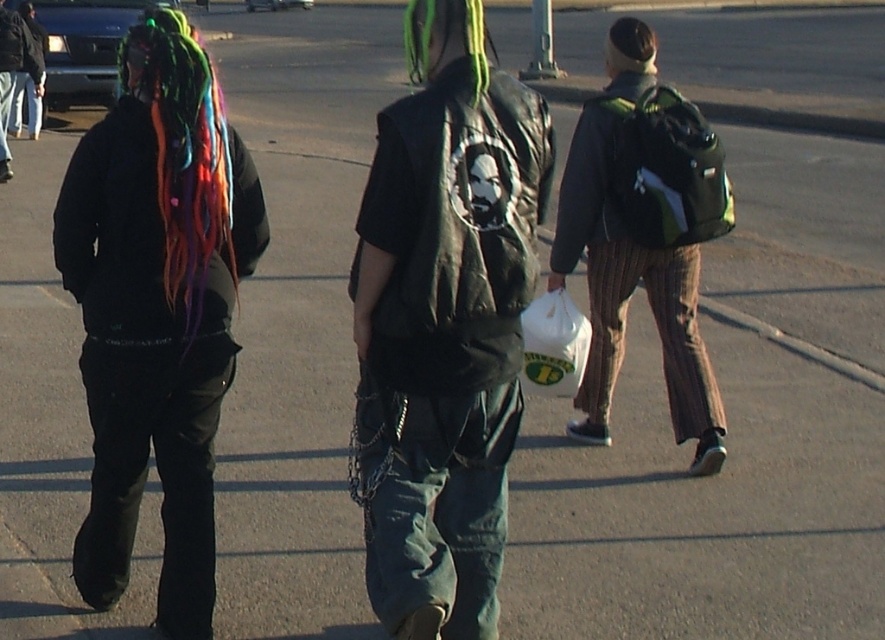
Who is positioned more to the left, black matte jacket at left or green matte hair at upper center?

Positioned to the left is black matte jacket at left.

Is black matte jacket at left above green matte hair at upper center?

No.

Where is `black matte jacket at left`? This screenshot has width=885, height=640. black matte jacket at left is located at coordinates (158, 308).

Where is `black matte jacket at left`? Image resolution: width=885 pixels, height=640 pixels. black matte jacket at left is located at coordinates (158, 308).

Which is above, white plastic bag at center or green dyed hair at center?

Positioned higher is green dyed hair at center.

Where is `white plastic bag at center`? Image resolution: width=885 pixels, height=640 pixels. white plastic bag at center is located at coordinates (553, 346).

Measure the distance between white plastic bag at center and camera.

A distance of 6.94 meters exists between white plastic bag at center and camera.

Find the location of a particular element. white plastic bag at center is located at coordinates (553, 346).

What do you see at coordinates (158, 308) in the screenshot? The image size is (885, 640). I see `black matte jacket at left` at bounding box center [158, 308].

Where is `black matte jacket at left`? Image resolution: width=885 pixels, height=640 pixels. black matte jacket at left is located at coordinates (158, 308).

Image resolution: width=885 pixels, height=640 pixels. I want to click on black matte jacket at left, so click(x=158, y=308).